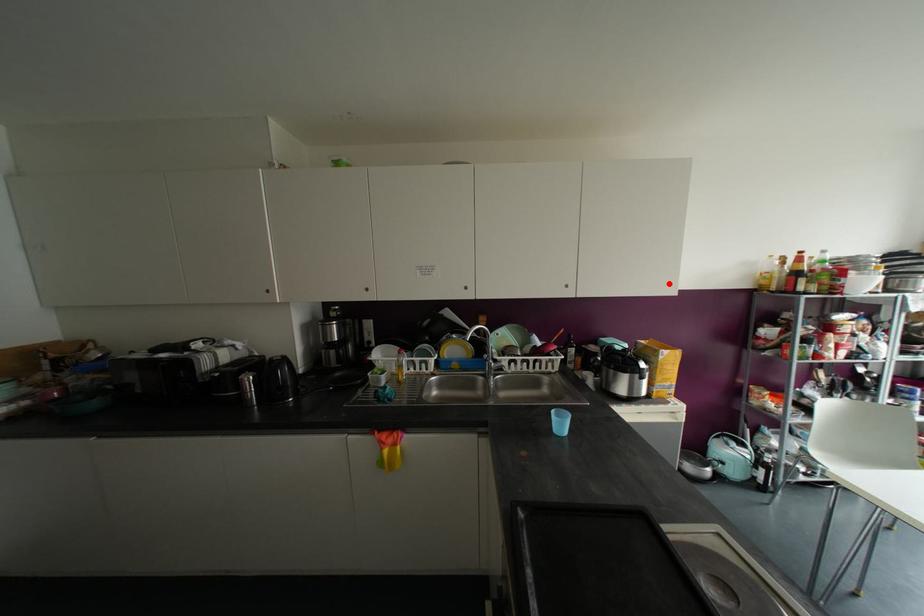
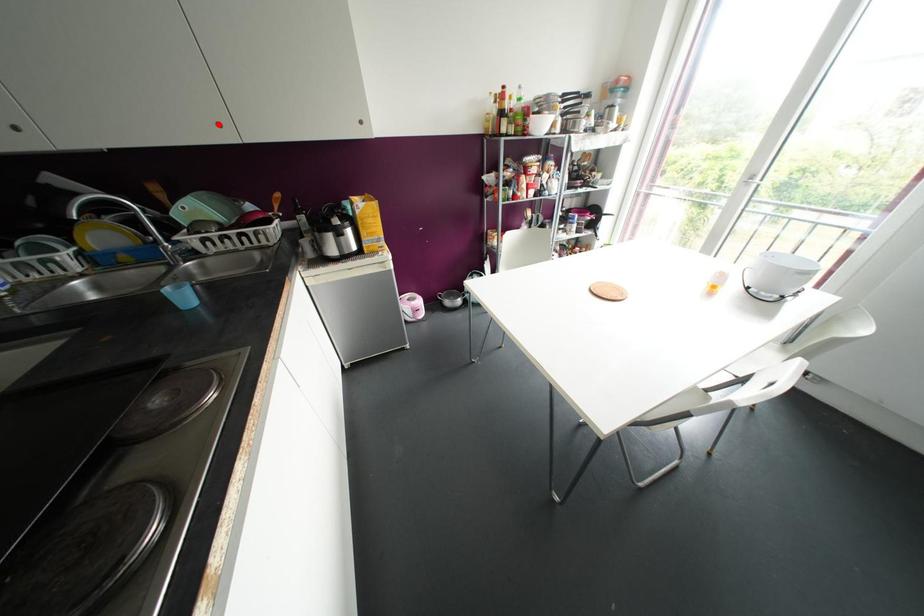
I am providing you with two images of the same scene from different viewpoints. A red point is marked on the first image and another point is marked on the second image. Are the points marked in image1 and image2 representing the same 3D position?

No